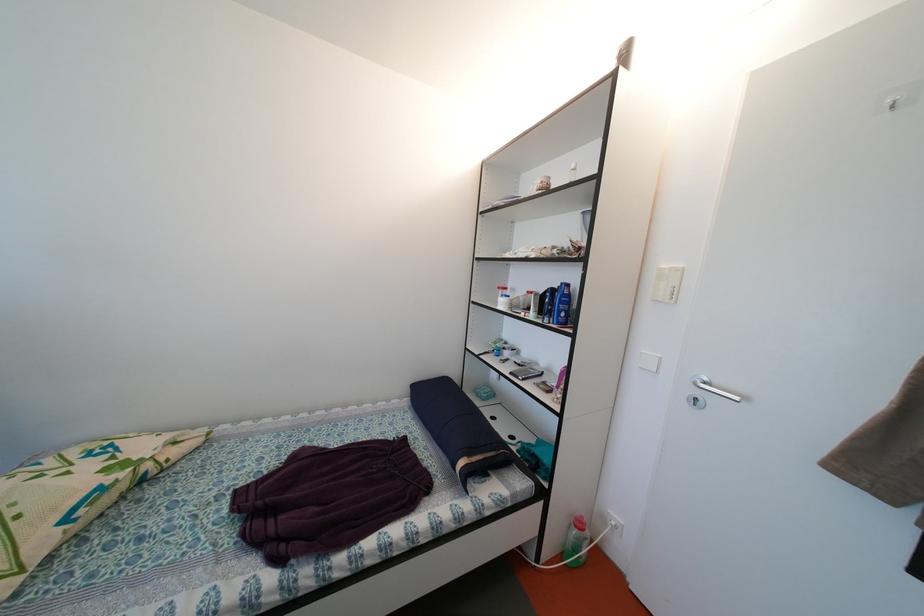
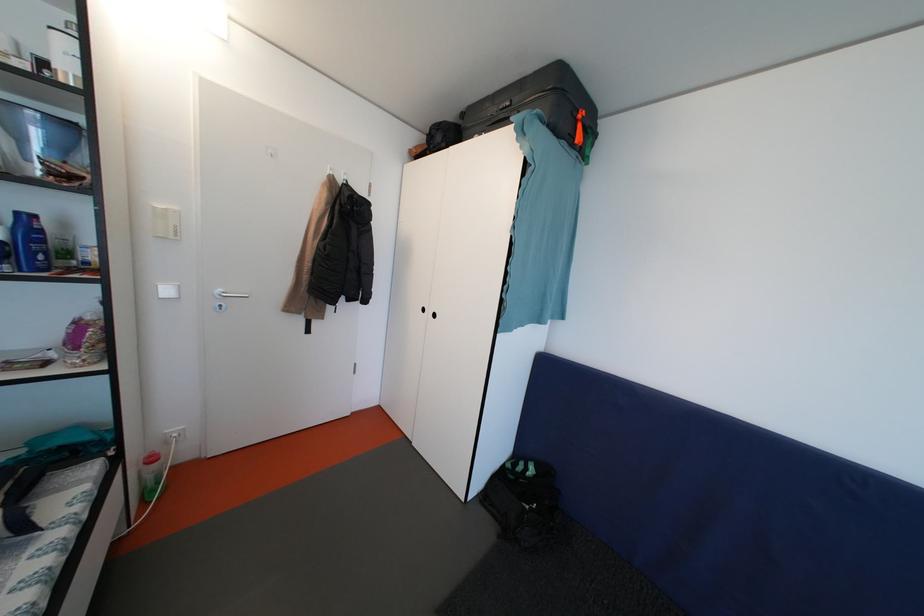
Based on the continuous images, in which direction is the camera rotating?

The camera rotated toward right-down.